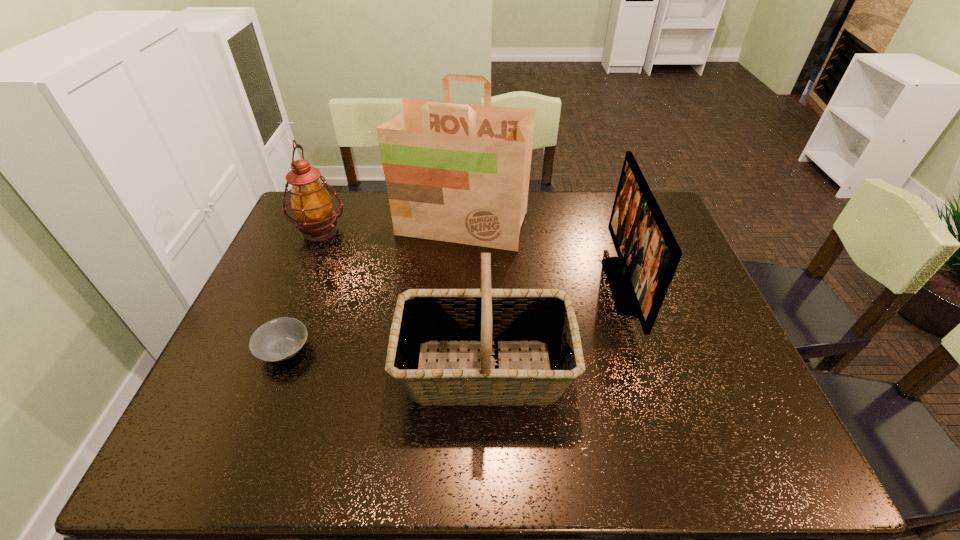
This screenshot has height=540, width=960. In the image, there is a desktop. Find the location of `vacant space at the near edge`. vacant space at the near edge is located at coordinates (612, 457).

Find the location of a particular element. vacant region at the left edge is located at coordinates (304, 292).

Find the location of `vacant space at the right edge of the desktop`. vacant space at the right edge of the desktop is located at coordinates (701, 319).

The image size is (960, 540). In order to click on empty space that is in between the grocery bag and the oil lamp in this screenshot , I will do `click(392, 228)`.

Locate an element on the screen. The width and height of the screenshot is (960, 540). free space between the oil lamp and the rightmost object is located at coordinates 471,259.

This screenshot has width=960, height=540. In order to click on vacant area that lies between the grocery bag and the oil lamp in this screenshot , I will do `click(392, 228)`.

The width and height of the screenshot is (960, 540). What are the coordinates of `blank region between the monitor and the tallest object` in the screenshot? It's located at (542, 255).

You are a GUI agent. You are given a task and a screenshot of the screen. Output one action in this format:
    pyautogui.click(x=<x>, y=<y>)
    Task: Click on the free space between the shortest object and the basket
    The width and height of the screenshot is (960, 540).
    Given the screenshot: What is the action you would take?
    pyautogui.click(x=384, y=361)

Identify the location of vacant space in between the shortest object and the tallest object. This screenshot has height=540, width=960. (373, 287).

This screenshot has width=960, height=540. In order to click on object that is the closest to the bowl in this screenshot , I will do `click(490, 319)`.